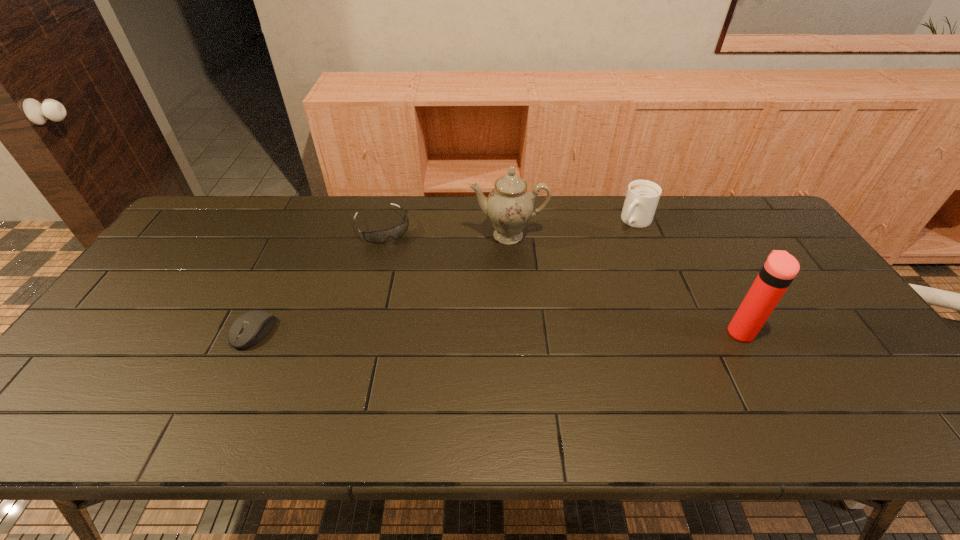
This screenshot has width=960, height=540. What are the coordinates of `empty space between the thermos bottle and the fourth tallest object` in the screenshot? It's located at (562, 279).

I want to click on vacant area that lies between the rightmost object and the chinaware, so click(624, 284).

At what (x,y) coordinates should I click in order to perform the action: click on vacant region between the chinaware and the fourth tallest object. Please return your answer as a coordinate pair (x, y). Image resolution: width=960 pixels, height=540 pixels. Looking at the image, I should click on (445, 231).

The width and height of the screenshot is (960, 540). What are the coordinates of `free space between the second shortest object and the computer equipment` in the screenshot? It's located at (319, 279).

You are a GUI agent. You are given a task and a screenshot of the screen. Output one action in this format:
    pyautogui.click(x=<x>, y=<y>)
    Task: Click on the vacant space that's between the thermos bottle and the third shortest object
    The height and width of the screenshot is (540, 960).
    Given the screenshot: What is the action you would take?
    pyautogui.click(x=687, y=276)

Identify the location of free space between the fourth object from right to left and the computer equipment. [x=319, y=279].

Locate an element on the screen. free area in between the third object from left to right and the rightmost object is located at coordinates (624, 284).

The height and width of the screenshot is (540, 960). I want to click on free space between the third tallest object and the leftmost object, so point(444,276).

Select which object appears as the third closest to the third object from right to left. Please provide its 2D coordinates. Your answer should be formatted as a tuple, i.e. [(x, y)], where the tuple contains the x and y coordinates of a point satisfying the conditions above.

[(780, 268)]

Find the location of a particular element. object that can be found as the third closest to the thermos bottle is located at coordinates (374, 236).